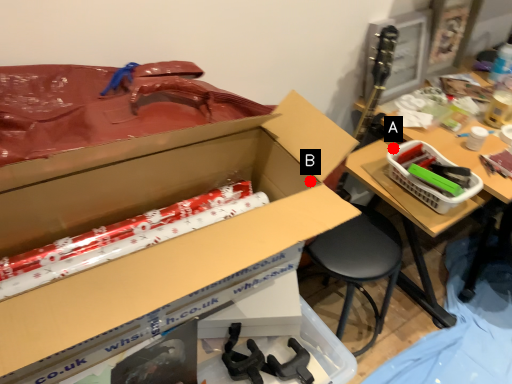
Question: Two points are circled on the image, labeled by A and B beside each circle. Which of the following is the closest to the observer?

Choices:
 (A) A is closer
 (B) B is closer

Answer: (B)